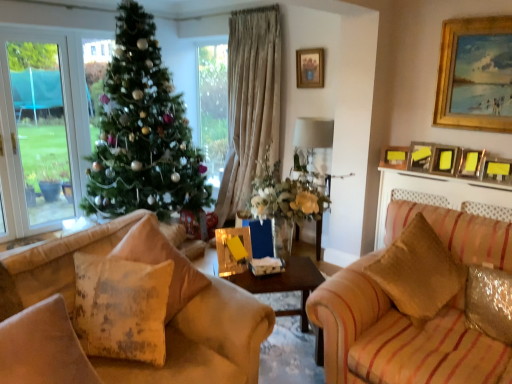
Question: Does gold-framed picture at upper center, the 7th picture frame in the right-to-left sequence, appear on the right side of shiny metallic pillow at lower right, the fourth pillow when ordered from left to right?

Choices:
 (A) yes
 (B) no

Answer: (B)

Question: From the image's perspective, is gold-framed picture at upper center, the 1th picture frame from the left, located above shiny metallic pillow at lower right, the fourth pillow when ordered from left to right?

Choices:
 (A) yes
 (B) no

Answer: (A)

Question: Does gold-framed picture at upper center, the 1th picture frame from the left, have a lesser width compared to shiny metallic pillow at lower right, the fourth pillow when ordered from left to right?

Choices:
 (A) yes
 (B) no

Answer: (A)

Question: Does gold-framed picture at upper center, the 1th picture frame from the left, lie in front of shiny metallic pillow at lower right, the fourth pillow when ordered from left to right?

Choices:
 (A) no
 (B) yes

Answer: (A)

Question: Does gold-framed picture at upper center, the 7th picture frame in the right-to-left sequence, appear on the left side of shiny metallic pillow at lower right, the fourth pillow when ordered from left to right?

Choices:
 (A) yes
 (B) no

Answer: (A)

Question: Would you say shiny metallic pillow at lower right, the first pillow from the right, is part of gold-framed picture at upper center, the 7th picture frame in the right-to-left sequence,'s contents?

Choices:
 (A) no
 (B) yes

Answer: (A)

Question: From the image's perspective, is shiny metallic pillow at lower right, the first pillow from the right, below metallic gold picture frame at upper right, positioned as the seventh picture frame in left-to-right order?

Choices:
 (A) yes
 (B) no

Answer: (A)

Question: Does shiny metallic pillow at lower right, the fourth pillow when ordered from left to right, turn towards metallic gold picture frame at upper right, positioned as the seventh picture frame in left-to-right order?

Choices:
 (A) yes
 (B) no

Answer: (B)

Question: From a real-world perspective, is shiny metallic pillow at lower right, the first pillow from the right, beneath metallic gold picture frame at upper right, positioned as the seventh picture frame in left-to-right order?

Choices:
 (A) no
 (B) yes

Answer: (B)

Question: Is shiny metallic pillow at lower right, the first pillow from the right, bigger than metallic gold picture frame at upper right, positioned as the first picture frame in right-to-left order?

Choices:
 (A) no
 (B) yes

Answer: (B)

Question: Can you confirm if shiny metallic pillow at lower right, the fourth pillow when ordered from left to right, is wider than metallic gold picture frame at upper right, positioned as the seventh picture frame in left-to-right order?

Choices:
 (A) no
 (B) yes

Answer: (B)

Question: Is shiny metallic pillow at lower right, the fourth pillow when ordered from left to right, not close to metallic gold picture frame at upper right, positioned as the first picture frame in right-to-left order?

Choices:
 (A) yes
 (B) no

Answer: (A)

Question: Is green matte christmas tree at center facing towards wooden table at center?

Choices:
 (A) yes
 (B) no

Answer: (A)